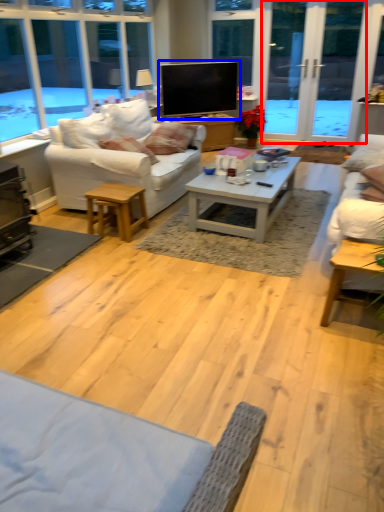
Question: Which object appears closest to the camera in this image, screen door (highlighted by a red box) or television (highlighted by a blue box)?

Choices:
 (A) screen door
 (B) television

Answer: (A)